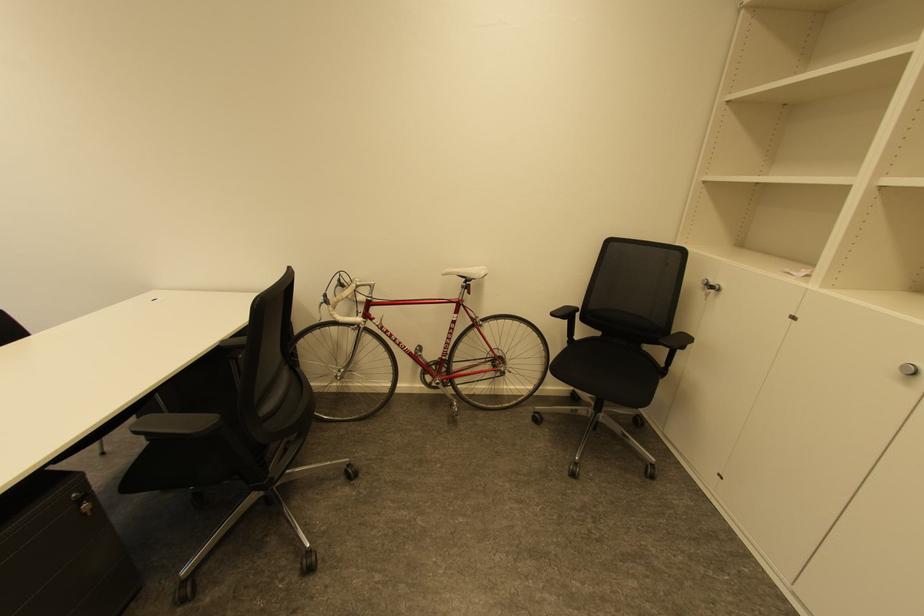
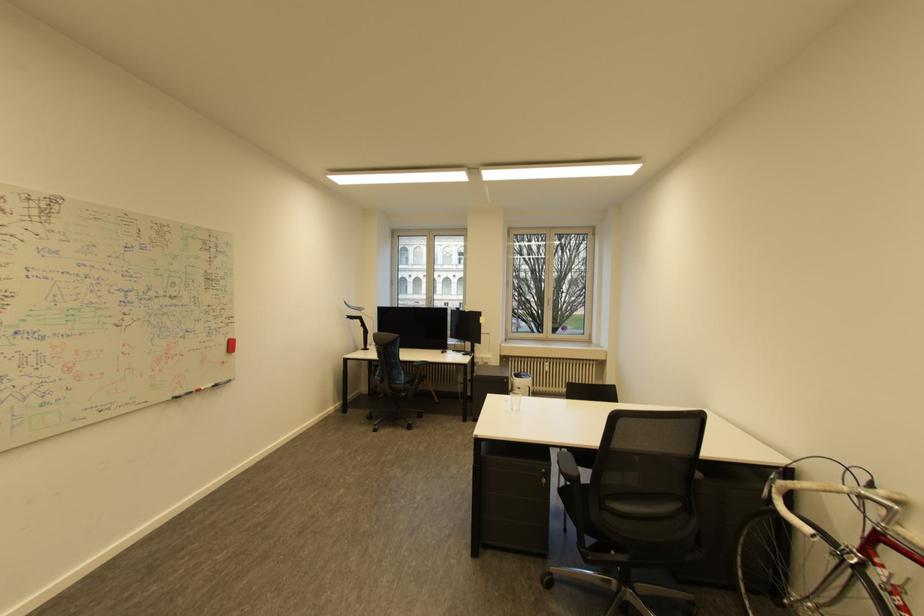
Locate, in the second image, the point that corresponds to [365,284] in the first image.

(869, 492)